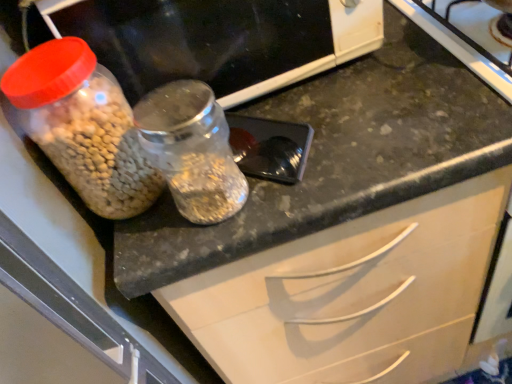
At what (x,y) coordinates should I click in order to perform the action: click on free location in front of translucent plastic jar at left. Please return your answer as a coordinate pair (x, y). This screenshot has width=512, height=384. Looking at the image, I should click on (160, 240).